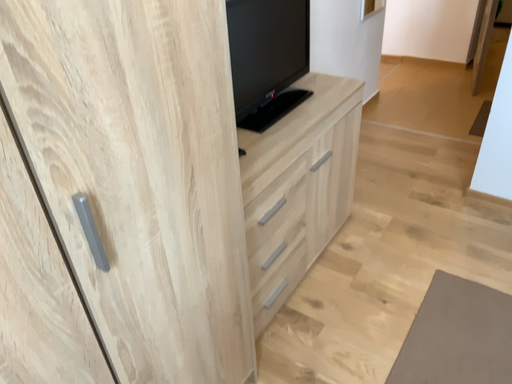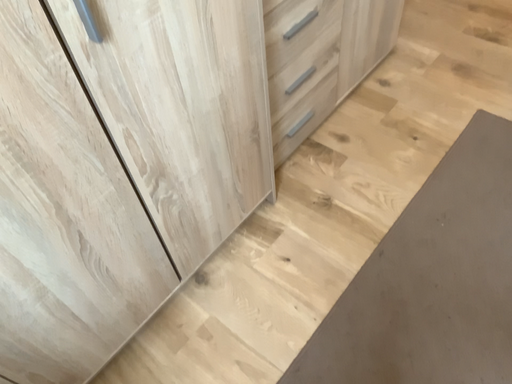
Question: Which way did the camera rotate in the video?

Choices:
 (A) rotated downward
 (B) rotated upward

Answer: (A)